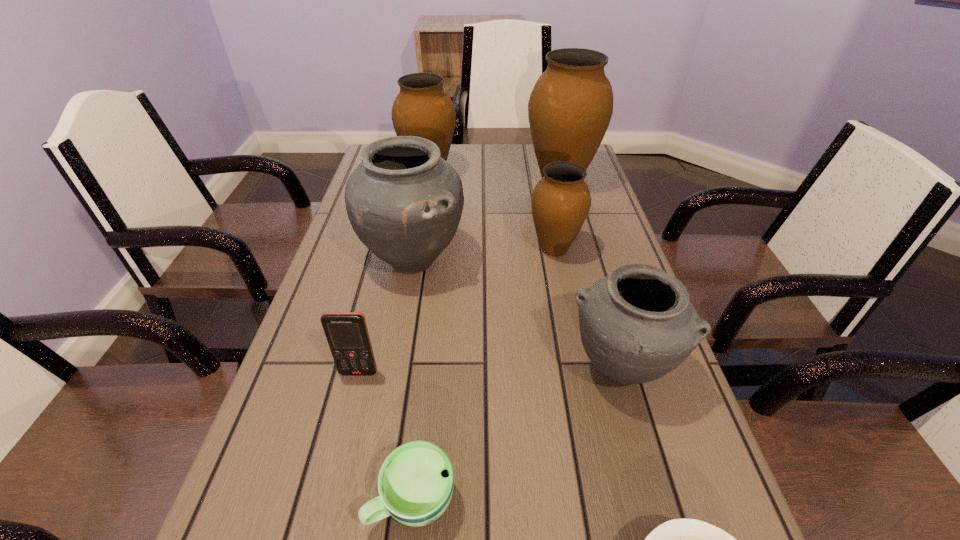
Identify the location of the tallest object. (570, 107).

This screenshot has height=540, width=960. What are the coordinates of `the biggest brown urn` in the screenshot? It's located at (570, 107).

Where is `the second smallest brown urn`? The height and width of the screenshot is (540, 960). the second smallest brown urn is located at coordinates (422, 108).

This screenshot has width=960, height=540. I want to click on the bigger black urn, so click(x=404, y=202).

Where is `the left black urn`? the left black urn is located at coordinates (404, 202).

What are the coordinates of `the smallest brown urn` in the screenshot? It's located at (561, 200).

This screenshot has height=540, width=960. Identify the location of the smaller black urn. (637, 324).

Find the location of a particular element. This screenshot has height=540, width=960. the right black urn is located at coordinates (637, 324).

At what (x,y) coordinates should I click in order to perform the action: click on cellular telephone. Please return your answer as a coordinate pair (x, y). Looking at the image, I should click on (347, 334).

Find the location of a particular element. Image resolution: width=960 pixels, height=540 pixels. the sixth tallest object is located at coordinates (347, 334).